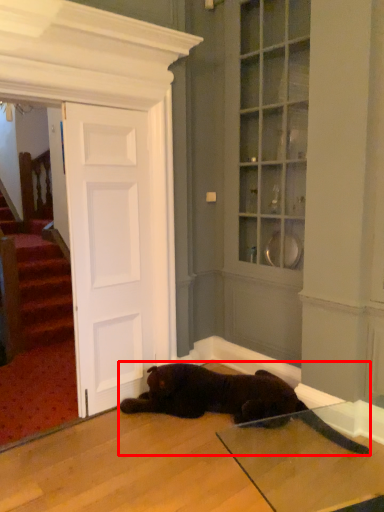
Question: From the image's perspective, what is the correct spatial positioning of cat (annotated by the red box) in reference to door?

Choices:
 (A) below
 (B) above

Answer: (A)